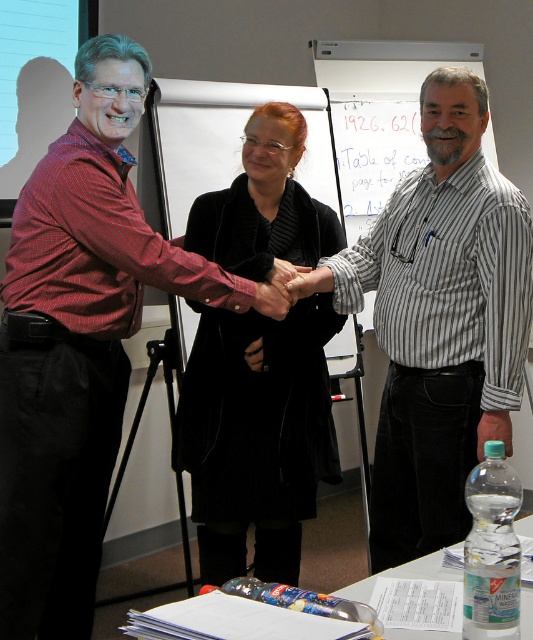
Question: Can you confirm if velvet black coat at center is positioned to the left of matte black hand at center?

Choices:
 (A) yes
 (B) no

Answer: (A)

Question: Is velvet black coat at center thinner than matte black hand at center?

Choices:
 (A) no
 (B) yes

Answer: (A)

Question: Which of the following is the farthest from the observer?

Choices:
 (A) matte black hand at center
 (B) velvet black coat at center
 (C) red checkered shirt at left
 (D) striped cotton shirt at center

Answer: (B)

Question: Which object is farther from the camera taking this photo?

Choices:
 (A) striped cotton shirt at center
 (B) velvet black coat at center
 (C) red checkered shirt at left

Answer: (B)

Question: Observing the image, what is the correct spatial positioning of velvet black coat at center in reference to matte black hand at center?

Choices:
 (A) below
 (B) above

Answer: (A)

Question: Which of these objects is positioned farthest from the red checkered shirt at left?

Choices:
 (A) matte black hand at center
 (B) striped cotton shirt at center

Answer: (B)